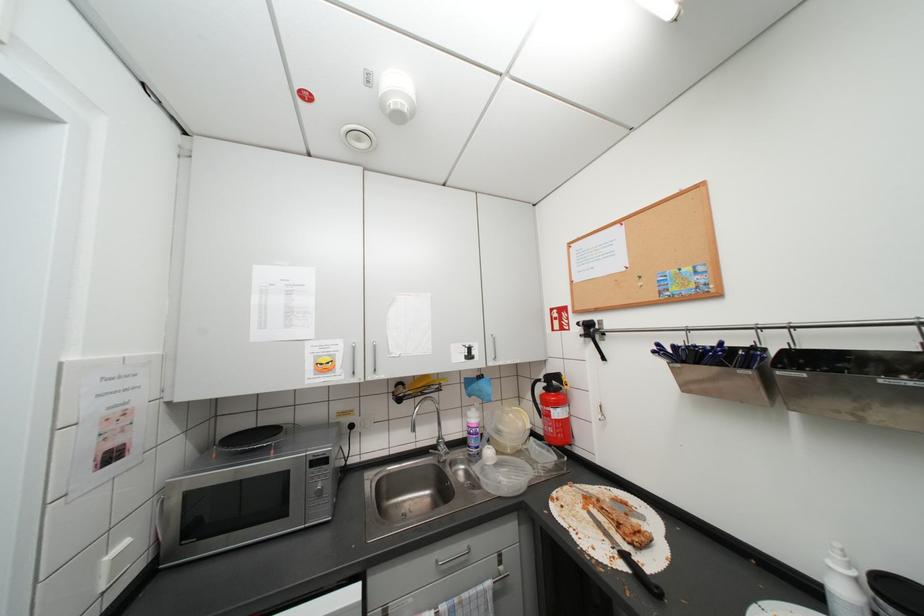
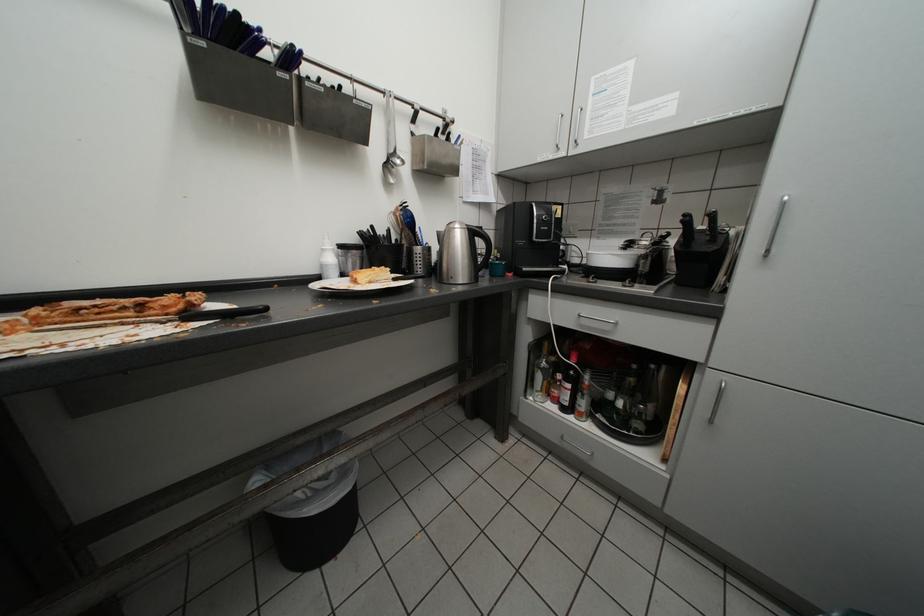
Question: How did the camera likely rotate?

Choices:
 (A) Left
 (B) Right
 (C) Up
 (D) Down

Answer: (B)